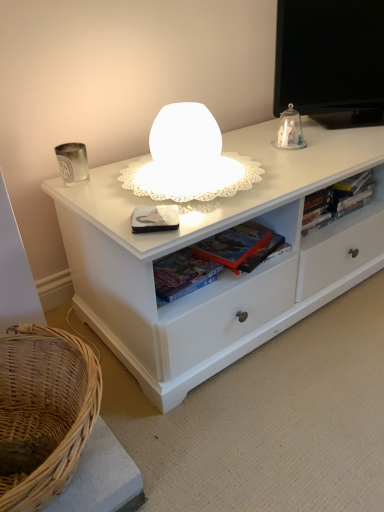
Question: From a real-world perspective, is white matte paperback book at center physically above hardcover book at right, which appears as the third book when viewed from the left?

Choices:
 (A) yes
 (B) no

Answer: (A)

Question: Does white matte paperback book at center have a larger size compared to hardcover book at right, which appears as the third book when viewed from the left?

Choices:
 (A) yes
 (B) no

Answer: (B)

Question: Can you confirm if white matte paperback book at center is shorter than hardcover book at right, the first book when ordered from right to left?

Choices:
 (A) no
 (B) yes

Answer: (B)

Question: Is white matte paperback book at center positioned with its back to hardcover book at right, the first book when ordered from right to left?

Choices:
 (A) no
 (B) yes

Answer: (A)

Question: Is white matte paperback book at center at the left side of hardcover book at right, the first book when ordered from right to left?

Choices:
 (A) no
 (B) yes

Answer: (B)

Question: From a real-world perspective, is clear glass dome at upper right physically located above or below hardcover book at center, the 3th book viewed from the right?

Choices:
 (A) below
 (B) above

Answer: (B)

Question: Would you say clear glass dome at upper right is inside or outside hardcover book at center, which ranks as the 1th book in left-to-right order?

Choices:
 (A) inside
 (B) outside

Answer: (B)

Question: In terms of height, does clear glass dome at upper right look taller or shorter compared to hardcover book at center, which ranks as the 1th book in left-to-right order?

Choices:
 (A) short
 (B) tall

Answer: (B)

Question: Based on their positions, is clear glass dome at upper right located to the left or right of hardcover book at center, which ranks as the 1th book in left-to-right order?

Choices:
 (A) right
 (B) left

Answer: (A)

Question: Is point (145, 229) closer or farther from the camera than point (162, 292)?

Choices:
 (A) closer
 (B) farther

Answer: (A)

Question: Based on their sizes in the image, would you say white matte paperback book at center is bigger or smaller than hardcover book at center, which appears as the second book when viewed from the left?

Choices:
 (A) big
 (B) small

Answer: (B)

Question: From the image's perspective, relative to hardcover book at center, which appears as the second book when viewed from the left, is white matte paperback book at center above or below?

Choices:
 (A) below
 (B) above

Answer: (B)

Question: Is white matte paperback book at center to the left or to the right of hardcover book at center, which appears as the second book when viewed from the left, in the image?

Choices:
 (A) right
 (B) left

Answer: (B)

Question: Is hardcover book at right, which appears as the third book when viewed from the left, spatially inside white matte paperback book at center, or outside of it?

Choices:
 (A) inside
 (B) outside

Answer: (B)

Question: In the image, is hardcover book at right, the first book when ordered from right to left, positioned in front of or behind white matte paperback book at center?

Choices:
 (A) front
 (B) behind

Answer: (B)